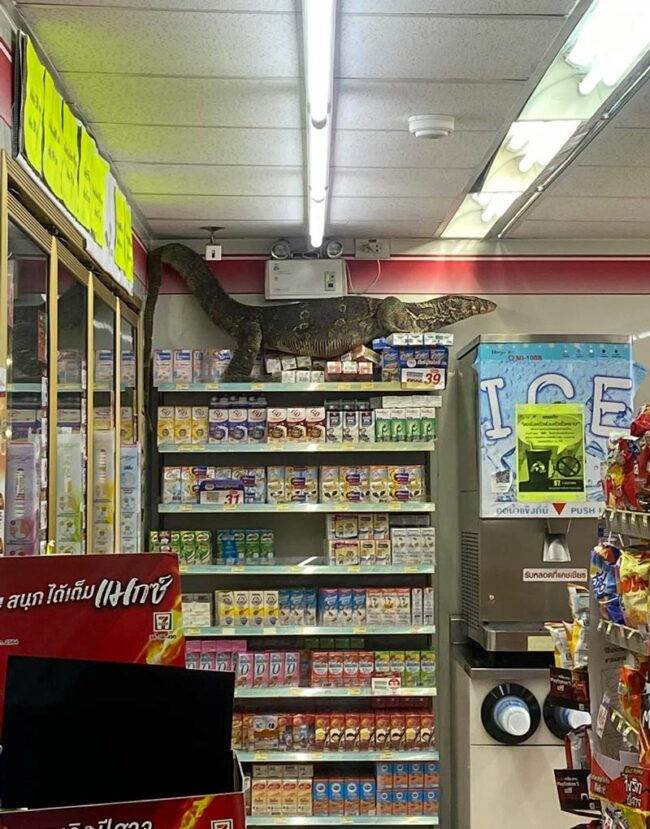
I want to click on shelves, so click(x=313, y=385), click(x=316, y=820), click(x=330, y=755), click(x=322, y=692), click(x=302, y=633), click(x=294, y=574), click(x=311, y=508), click(x=309, y=444).